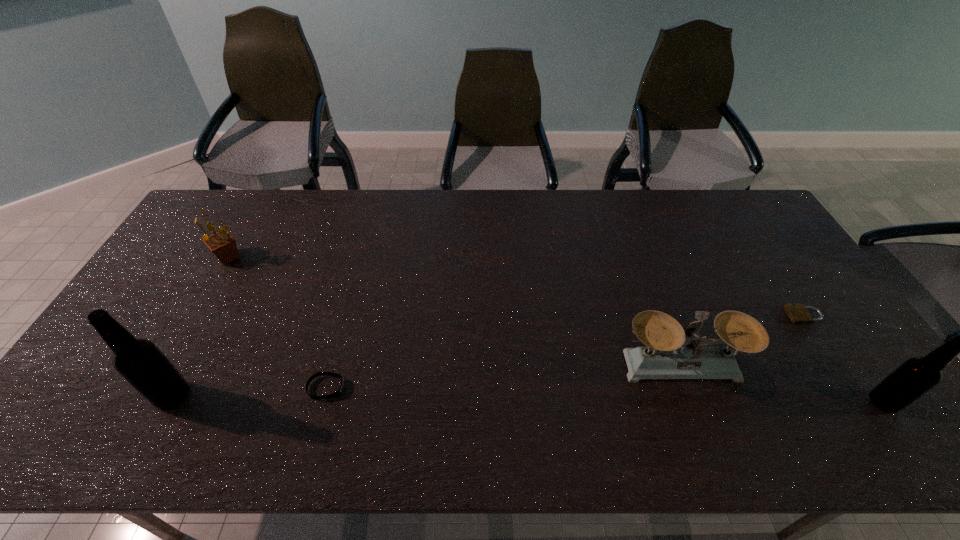
Where is `vacant space that satisfies the following two spatial constraints: 1. on the front-facing side of the third object from right to left; 2. on the display of the wristband`? The height and width of the screenshot is (540, 960). vacant space that satisfies the following two spatial constraints: 1. on the front-facing side of the third object from right to left; 2. on the display of the wristband is located at coordinates (689, 388).

In order to click on vacant space that satisfies the following two spatial constraints: 1. on the front-facing side of the scale; 2. on the left side of the second tallest object in this screenshot , I will do `click(695, 402)`.

This screenshot has width=960, height=540. I want to click on blank area in the image that satisfies the following two spatial constraints: 1. at the front of the left beer bottle with flowers visible; 2. on the left side of the farthest object, so click(149, 396).